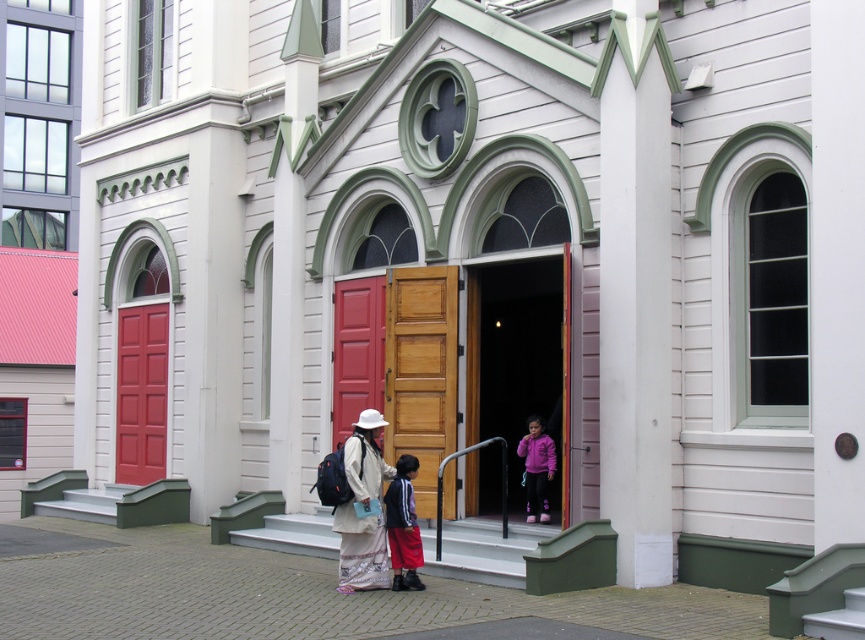
Is matte red door at center positioned at the back of matte white hat at center?

Yes, matte red door at center is behind matte white hat at center.

Is matte red door at center to the right of matte white hat at center from the viewer's perspective?

No, matte red door at center is not to the right of matte white hat at center.

Identify the location of matte red door at center. This screenshot has height=640, width=865. (357, 349).

Find the location of a particular element. The height and width of the screenshot is (640, 865). matte red door at center is located at coordinates (357, 349).

This screenshot has width=865, height=640. I want to click on wooden door at center, so click(x=420, y=371).

This screenshot has height=640, width=865. What do you see at coordinates (420, 371) in the screenshot?
I see `wooden door at center` at bounding box center [420, 371].

The image size is (865, 640). Find the location of `wooden door at center`. wooden door at center is located at coordinates (420, 371).

The image size is (865, 640). I want to click on smooth concrete stairs at center, so click(x=482, y=548).

Is smooth concrete stairs at center above matte white hat at center?

No.

Identify the location of smooth concrete stairs at center. This screenshot has width=865, height=640. (482, 548).